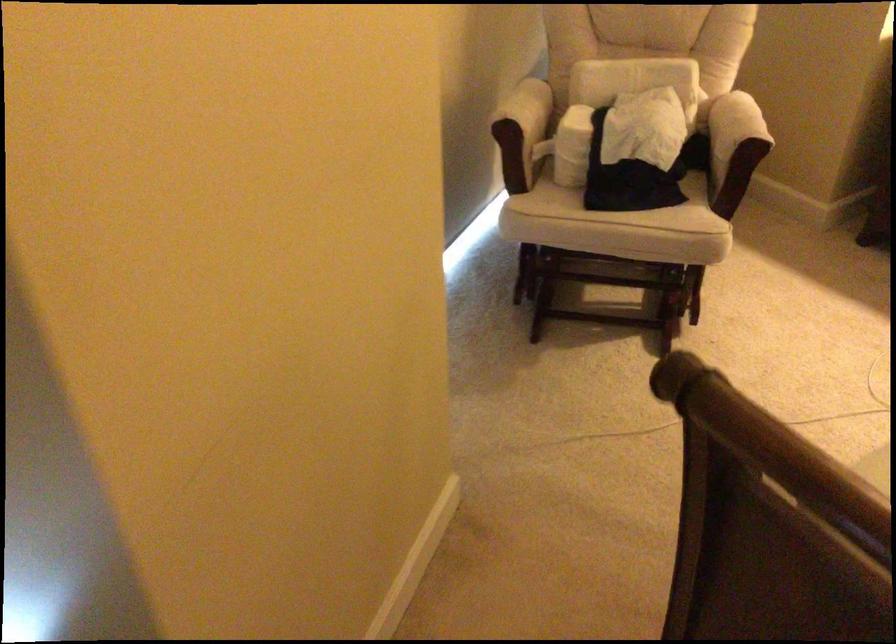
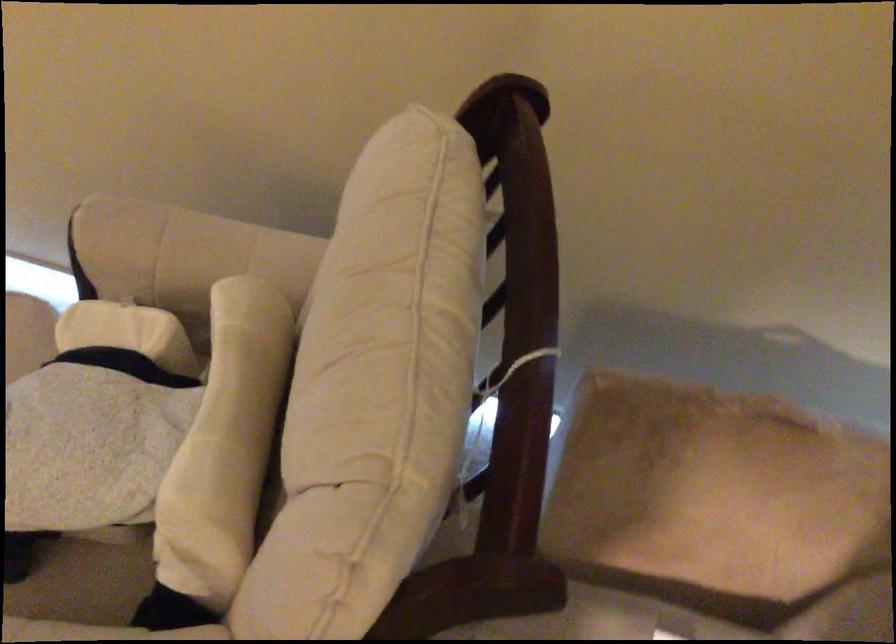
Where in the second image is the point corresponding to (x=682, y=184) from the first image?

(82, 583)